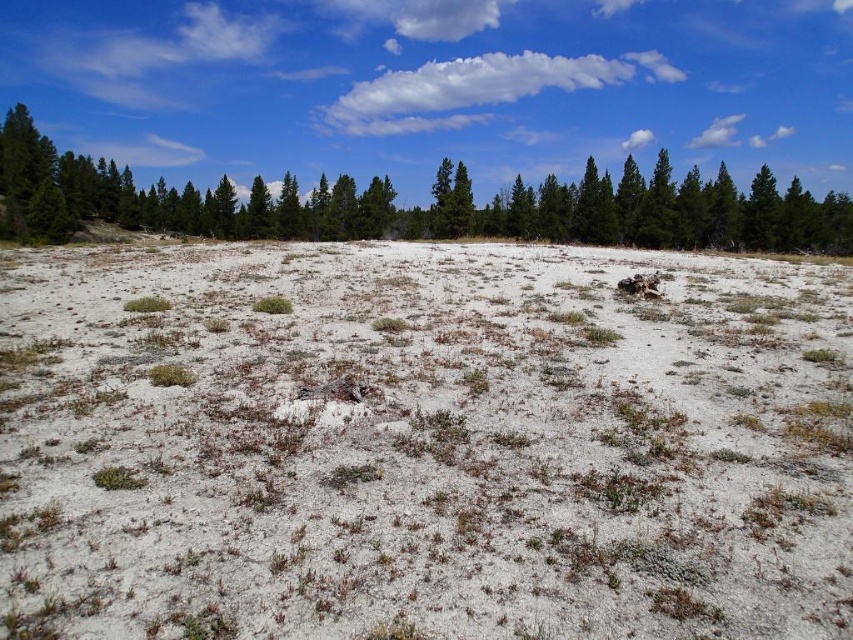
Consider the image. You are standing at the point with coordinates point (39, 136) and want to walk towards the point with coordinates point (271, 552). According to the scene, will you be moving towards the background or the foreground?

Point (271, 552) is in front of point (39, 136), so moving towards it means you are moving towards the foreground.

You are a hiker trying to navigate the landscape shown. You need to determine which object is closer to the horizon. Based on the image, which one is closer to the horizon between the white sandy plain at center and the green textured pine at upper center?

The green textured pine at upper center is closer to the horizon than the white sandy plain at center.

You are standing on the white sandy plain at center and looking towards the green textured pine at upper center. Which object is nearer to you?

The white sandy plain at center is closer to the viewer than the green textured pine at upper center.